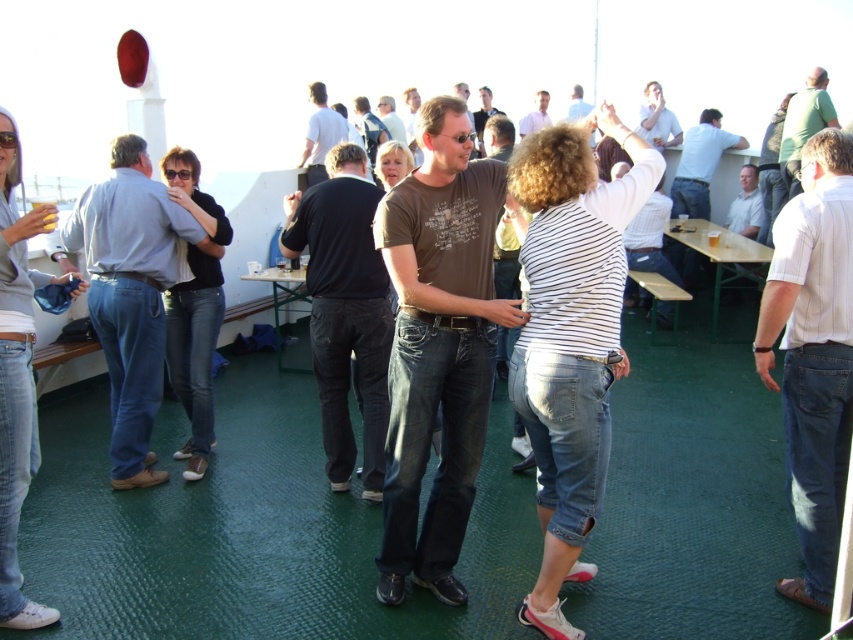
Does white striped shirt at center appear on the left side of brown cotton shirt at center?

Incorrect, white striped shirt at center is not on the left side of brown cotton shirt at center.

Is white striped shirt at center positioned before brown cotton shirt at center?

Yes, white striped shirt at center is in front of brown cotton shirt at center.

What do you see at coordinates (813, 353) in the screenshot?
I see `white striped shirt at center` at bounding box center [813, 353].

At what (x,y) coordinates should I click in order to perform the action: click on white striped shirt at center. Please return your answer as a coordinate pair (x, y). This screenshot has width=853, height=640. Looking at the image, I should click on (813, 353).

Does white matte shirt at center have a greater height compared to white shirt at center?

Indeed, white matte shirt at center has a greater height compared to white shirt at center.

Which of these two, white matte shirt at center or white shirt at center, stands shorter?

white shirt at center

Which is in front, point (322, 124) or point (738, 195)?

Point (322, 124) is in front.

You are a GUI agent. You are given a task and a screenshot of the screen. Output one action in this format:
    pyautogui.click(x=<x>, y=<y>)
    Task: Click on the white matte shirt at center
    
    Given the screenshot: What is the action you would take?
    pyautogui.click(x=320, y=132)

Which of these two, green matte shirt at upper right or brown leather jacket at center, stands shorter?

Standing shorter between the two is green matte shirt at upper right.

You are a GUI agent. You are given a task and a screenshot of the screen. Output one action in this format:
    pyautogui.click(x=<x>, y=<y>)
    Task: Click on the green matte shirt at upper right
    
    Given the screenshot: What is the action you would take?
    point(804,124)

Describe the element at coordinates (804, 124) in the screenshot. I see `green matte shirt at upper right` at that location.

Find the location of a particular element. green matte shirt at upper right is located at coordinates (804, 124).